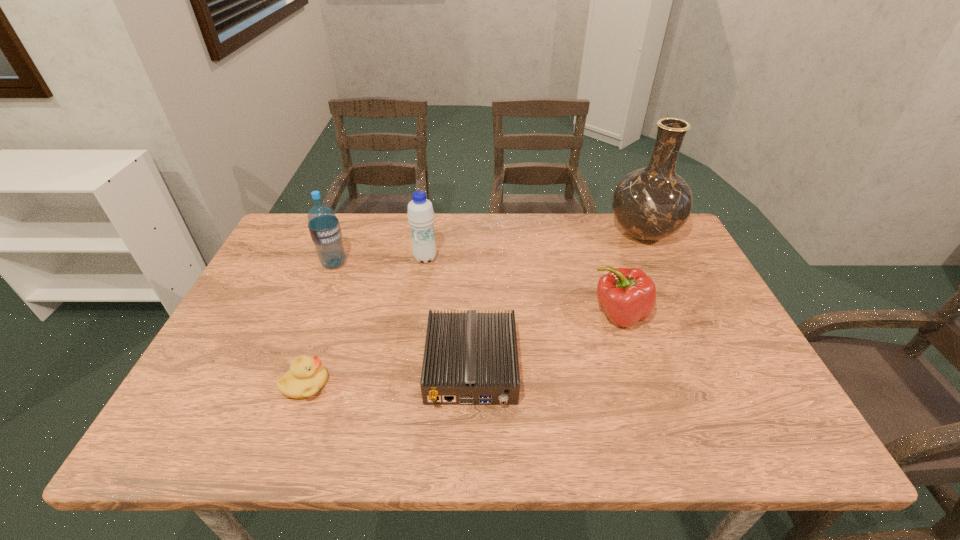
The width and height of the screenshot is (960, 540). Find the location of `vacant area located 0.380m on the front-facing side of the duckling`. vacant area located 0.380m on the front-facing side of the duckling is located at coordinates (501, 384).

Where is `vase positioned at the far edge`? This screenshot has width=960, height=540. vase positioned at the far edge is located at coordinates (651, 203).

Locate an element on the screen. This screenshot has width=960, height=540. object present at the near edge is located at coordinates (471, 358).

Find the location of `object situated at the left edge`. object situated at the left edge is located at coordinates (324, 227).

Locate an element on the screen. The height and width of the screenshot is (540, 960). object positioned at the right edge is located at coordinates (651, 203).

Where is `object that is positioned at the far left corner`? This screenshot has width=960, height=540. object that is positioned at the far left corner is located at coordinates (324, 227).

The width and height of the screenshot is (960, 540). Identify the location of object present at the far right corner. (651, 203).

This screenshot has width=960, height=540. I want to click on free region at the far edge, so click(x=614, y=245).

The width and height of the screenshot is (960, 540). I want to click on vacant space at the near edge, so click(x=252, y=439).

You are a GUI agent. You are given a task and a screenshot of the screen. Output one action in this format:
    pyautogui.click(x=<x>, y=<y>)
    Task: Click on the vacant region at the left edge of the desktop
    
    Given the screenshot: What is the action you would take?
    pyautogui.click(x=189, y=403)